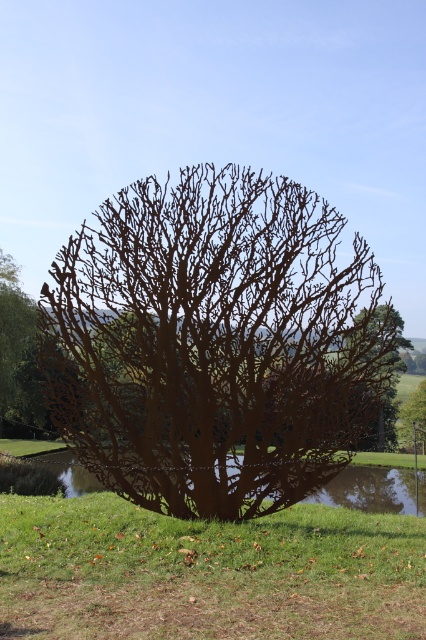
Question: Is rusty metal tree at center above rustic wood tree at center?

Choices:
 (A) yes
 (B) no

Answer: (A)

Question: Is rusty metal tree at center behind rustic wood tree at center?

Choices:
 (A) no
 (B) yes

Answer: (A)

Question: Which point is closer to the camera?

Choices:
 (A) (324, 410)
 (B) (417, 419)

Answer: (A)

Question: Is rusty metal tree at center smaller than rustic wood tree at center?

Choices:
 (A) no
 (B) yes

Answer: (B)

Question: Which object is farther from the camera taking this photo?

Choices:
 (A) rustic wood tree at center
 (B) rusty metal tree at center

Answer: (A)